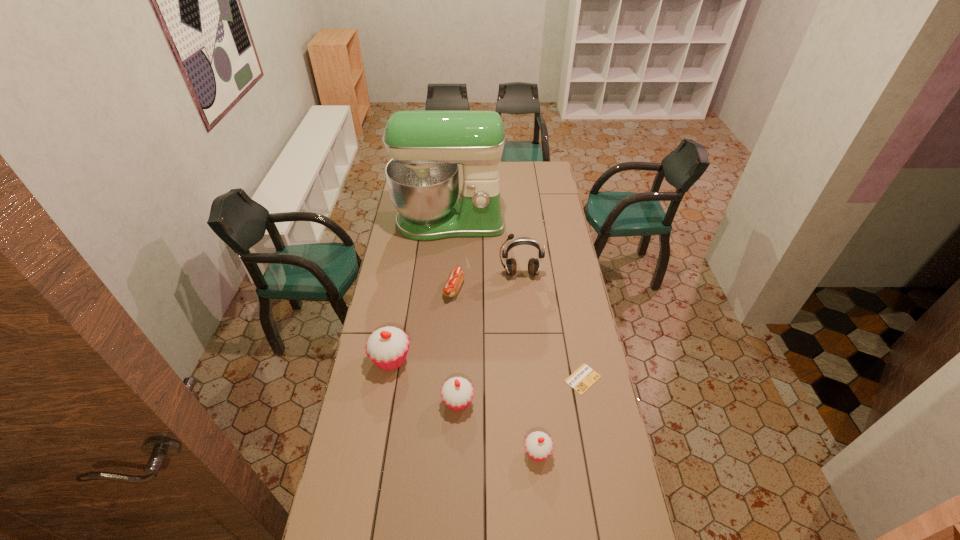
The image size is (960, 540). Find the location of `vacant region that satisfies the following two spatial constraints: 1. on the ear pads of the sixth shortest object; 2. on the right side of the shortest object`. vacant region that satisfies the following two spatial constraints: 1. on the ear pads of the sixth shortest object; 2. on the right side of the shortest object is located at coordinates (531, 379).

Where is `blank space that satisfies the following two spatial constraints: 1. on the controls of the second shortest object; 2. on the left side of the mixer`? The width and height of the screenshot is (960, 540). blank space that satisfies the following two spatial constraints: 1. on the controls of the second shortest object; 2. on the left side of the mixer is located at coordinates (444, 289).

What are the coordinates of `free location that satisfies the following two spatial constraints: 1. on the front side of the sausage; 2. on the left side of the identity card` in the screenshot? It's located at (448, 379).

Where is `vacant space that satisfies the following two spatial constraints: 1. on the controls of the second nearest cupcake; 2. on the left side of the mixer`? vacant space that satisfies the following two spatial constraints: 1. on the controls of the second nearest cupcake; 2. on the left side of the mixer is located at coordinates (435, 402).

This screenshot has width=960, height=540. I want to click on vacant region that satisfies the following two spatial constraints: 1. on the ear pads of the rightmost object; 2. on the left side of the second tallest object, so click(x=531, y=379).